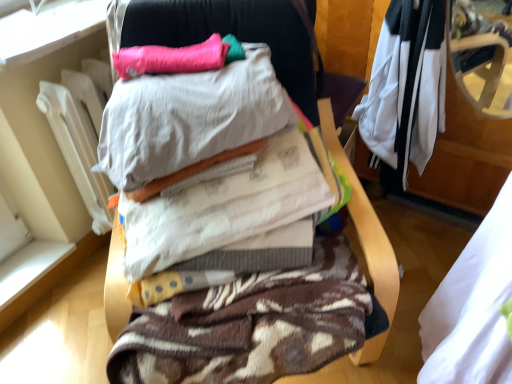
Question: Would you say white/black fabric jacket at upper right, the fourth clothing when ordered from front to back, is to the left or to the right of white fabric at right, placed as the 1th clothing when sorted from front to back, in the picture?

Choices:
 (A) left
 (B) right

Answer: (B)

Question: From the image's perspective, is white/black fabric jacket at upper right, the fourth clothing when ordered from front to back, located above or below white fabric at right, the fourth clothing from the back?

Choices:
 (A) above
 (B) below

Answer: (A)

Question: Which object is positioned closest to the brown knitted blanket at center, which appears as the second clothing when viewed from the back?

Choices:
 (A) white cotton sheets at center, the 3th clothing when ordered from back to front
 (B) soft cotton pillow at center, the second pillow from the back
 (C) brown textured blanket at center
 (D) white/black fabric jacket at upper right, the 1th clothing when ordered from back to front
 (E) white fabric at right, the fourth clothing from the back

Answer: (A)

Question: Based on their relative distances, which object is farther from the brown textured blanket at center?

Choices:
 (A) white cotton sheets at center, the 3th clothing when ordered from back to front
 (B) soft cotton pillow at center, the second pillow from the back
 (C) white fabric at right, the fourth clothing from the back
 (D) brown knitted blanket at center, which appears as the second clothing when viewed from the back
 (E) white/black fabric jacket at upper right, the 1th clothing when ordered from back to front

Answer: (C)